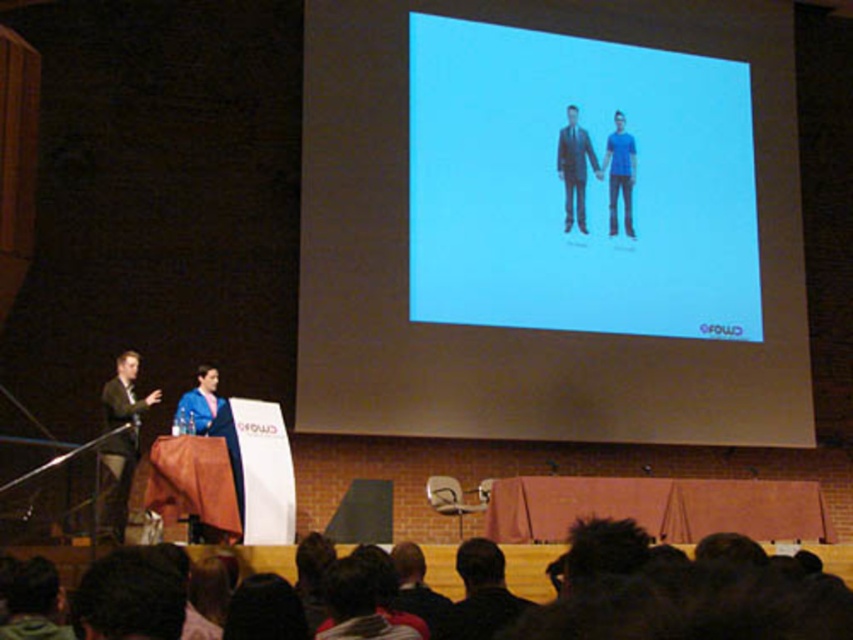
You are an attendee at the presentation and want to describe the presenters based on their clothing. Which presenter is positioned lower in the image, the one wearing the matte black suit at left or the blue matte shirt at center?

The matte black suit at left is positioned lower in the image than the blue matte shirt at center.

You are standing in the audience looking at the stage. Where is the matte black suit at left located in terms of its 2D coordinates on the stage?

The matte black suit at left is located at the 2D coordinates point (119, 445) on the stage.